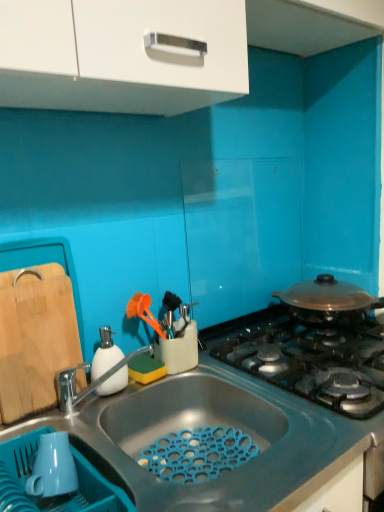
Question: Considering the relative positions of natural wood cutting board at left and blue matte sink at lower center in the image provided, is natural wood cutting board at left in front of blue matte sink at lower center?

Choices:
 (A) yes
 (B) no

Answer: (B)

Question: Can you confirm if natural wood cutting board at left is shorter than blue matte sink at lower center?

Choices:
 (A) yes
 (B) no

Answer: (A)

Question: Is natural wood cutting board at left far away from blue matte sink at lower center?

Choices:
 (A) yes
 (B) no

Answer: (B)

Question: From a real-world perspective, is natural wood cutting board at left on top of blue matte sink at lower center?

Choices:
 (A) no
 (B) yes

Answer: (B)

Question: Does natural wood cutting board at left come behind blue matte sink at lower center?

Choices:
 (A) yes
 (B) no

Answer: (A)

Question: Which is correct: white matte soap dispenser at left is inside white glossy cabinet at upper center, or outside of it?

Choices:
 (A) outside
 (B) inside

Answer: (A)

Question: From their relative heights in the image, would you say white matte soap dispenser at left is taller or shorter than white glossy cabinet at upper center?

Choices:
 (A) short
 (B) tall

Answer: (A)

Question: In the image, is white matte soap dispenser at left positioned in front of or behind white glossy cabinet at upper center?

Choices:
 (A) behind
 (B) front

Answer: (A)

Question: From the image's perspective, is white matte soap dispenser at left positioned above or below white glossy cabinet at upper center?

Choices:
 (A) below
 (B) above

Answer: (A)

Question: Based on their sizes in the image, would you say white glossy cabinet at upper center is bigger or smaller than blue matte sink at lower center?

Choices:
 (A) small
 (B) big

Answer: (A)

Question: Looking at their shapes, would you say white glossy cabinet at upper center is wider or thinner than blue matte sink at lower center?

Choices:
 (A) wide
 (B) thin

Answer: (B)

Question: From a real-world perspective, is white glossy cabinet at upper center positioned above or below blue matte sink at lower center?

Choices:
 (A) above
 (B) below

Answer: (A)

Question: Is white glossy cabinet at upper center inside or outside of blue matte sink at lower center?

Choices:
 (A) outside
 (B) inside

Answer: (A)

Question: Based on their positions, is natural wood cutting board at left located to the left or right of blue matte sink at lower center?

Choices:
 (A) left
 (B) right

Answer: (A)

Question: Looking at their shapes, would you say natural wood cutting board at left is wider or thinner than blue matte sink at lower center?

Choices:
 (A) thin
 (B) wide

Answer: (A)